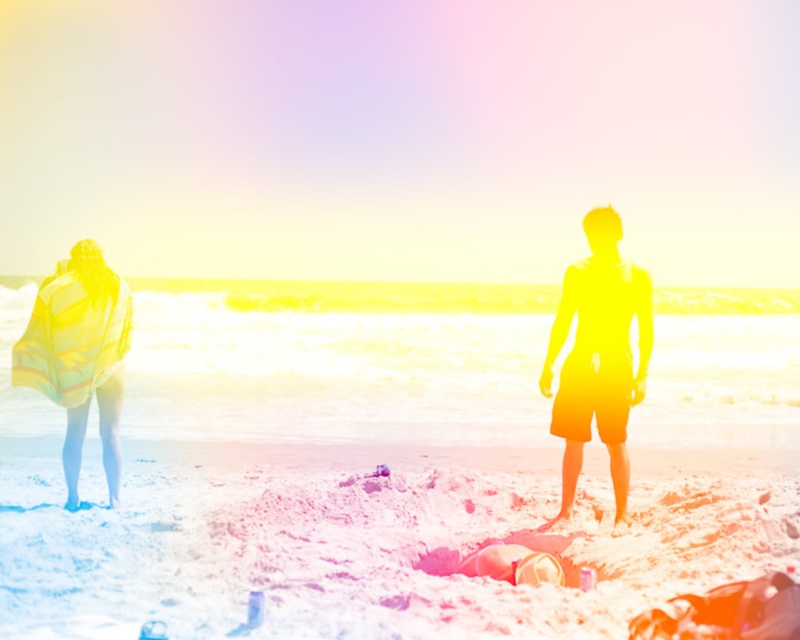
Question: Does white sandy beach at center have a lesser width compared to yellow striped towel at left?

Choices:
 (A) no
 (B) yes

Answer: (A)

Question: Can you confirm if silhouette shorts at center is positioned above yellow striped towel at left?

Choices:
 (A) yes
 (B) no

Answer: (A)

Question: Which point is farther to the camera?

Choices:
 (A) silhouette shorts at center
 (B) yellow striped towel at left

Answer: (B)

Question: Among these objects, which one is farthest from the camera?

Choices:
 (A) white sandy beach at center
 (B) yellow striped towel at left
 (C) silhouette shorts at center

Answer: (B)

Question: Among these objects, which one is farthest from the camera?

Choices:
 (A) white sandy beach at center
 (B) silhouette shorts at center

Answer: (B)

Question: Can you confirm if white sandy beach at center is bigger than silhouette shorts at center?

Choices:
 (A) yes
 (B) no

Answer: (A)